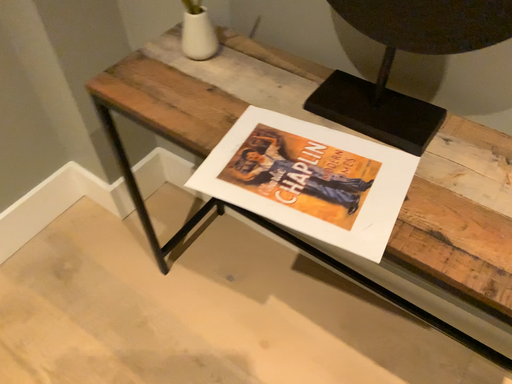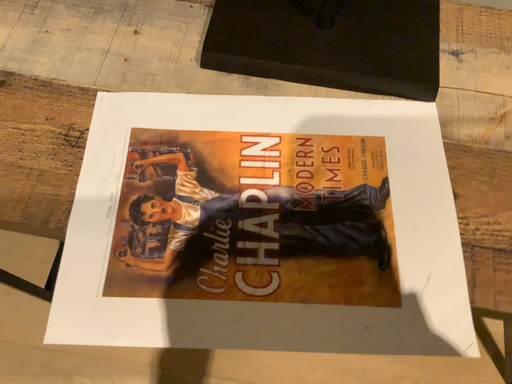
Question: Which way did the camera rotate in the video?

Choices:
 (A) rotated upward
 (B) rotated downward

Answer: (B)